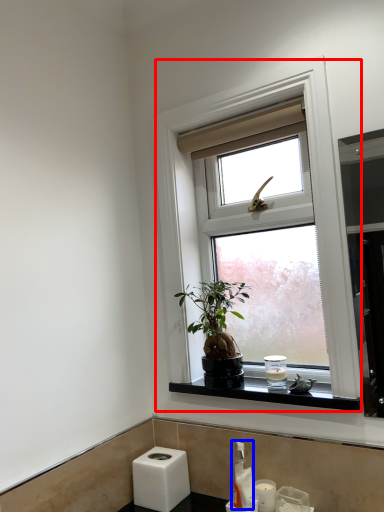
Question: Which of the following is the closest to the observer, window (highlighted by a red box) or soap dispenser (highlighted by a blue box)?

Choices:
 (A) window
 (B) soap dispenser

Answer: (A)